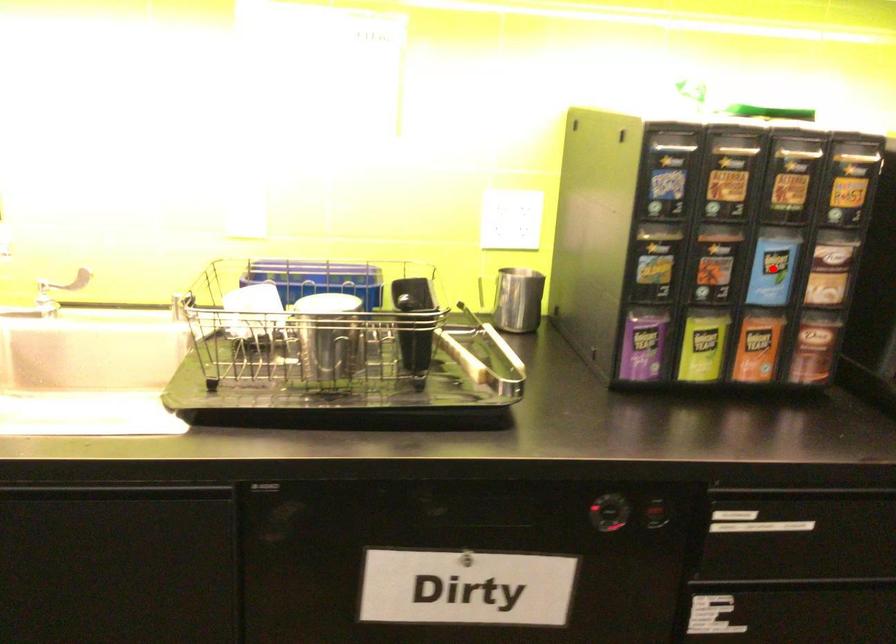
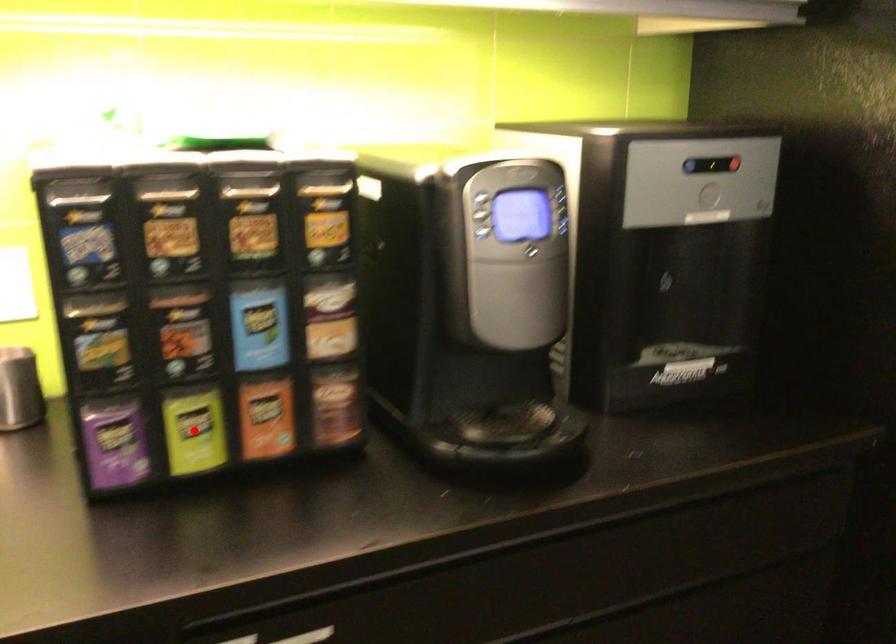
I am providing you with two images of the same scene from different viewpoints. A red point is marked on the first image and another point is marked on the second image. Does the point marked in image1 correspond to the same location as the one in image2?

No